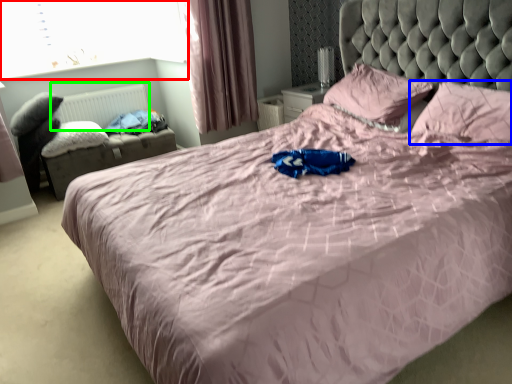
Question: Based on their relative distances, which object is farther from window screen (highlighted by a red box)? Choose from pillow (highlighted by a blue box) and radiator (highlighted by a green box).

Choices:
 (A) pillow
 (B) radiator

Answer: (A)